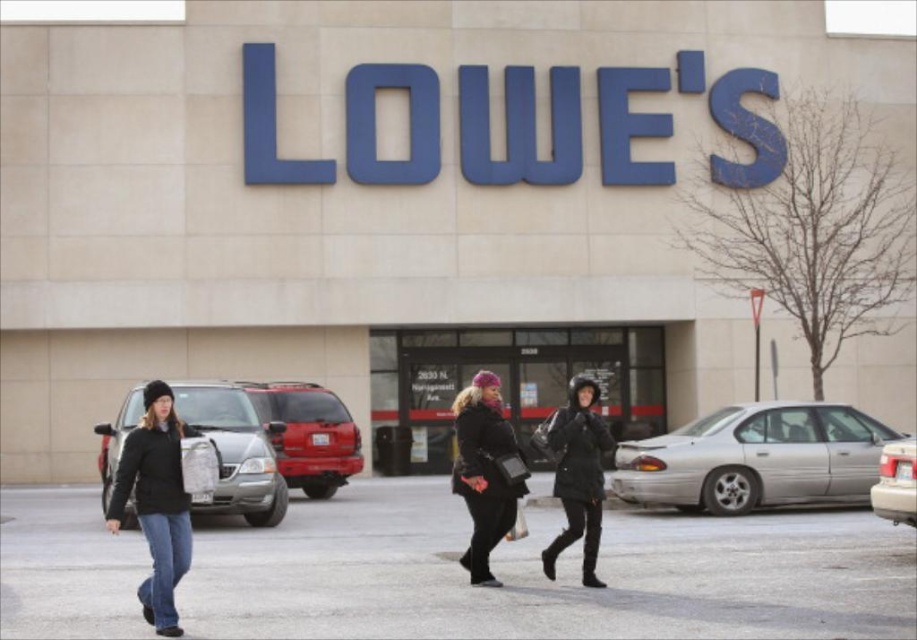
Between black matte storefront at center and black puffy coat at center, which one appears on the right side from the viewer's perspective?

black matte storefront at center is more to the right.

Which is behind, point (388, 358) or point (564, 476)?

The point (388, 358) is behind.

Locate an element on the screen. This screenshot has height=640, width=917. black matte storefront at center is located at coordinates click(x=506, y=381).

Who is more distant from viewer, (655, 330) or (329, 420)?

Positioned behind is point (655, 330).

The width and height of the screenshot is (917, 640). Describe the element at coordinates (506, 381) in the screenshot. I see `black matte storefront at center` at that location.

Image resolution: width=917 pixels, height=640 pixels. What are the coordinates of `black matte storefront at center` in the screenshot? It's located at (506, 381).

Does black matte storefront at center appear on the right side of black matte jacket at left?

Yes, black matte storefront at center is to the right of black matte jacket at left.

From the picture: Is black matte storefront at center positioned before black matte jacket at left?

That is False.

Does point (402, 371) come in front of point (116, 518)?

No, it is not.

Where is `black matte storefront at center`? black matte storefront at center is located at coordinates (x=506, y=381).